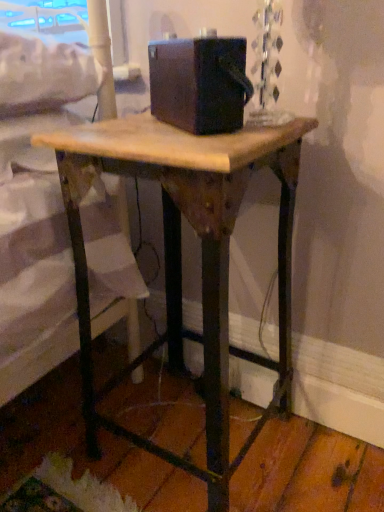
Where is `free space underneath wooden table at center (from a real-world perspective)`? free space underneath wooden table at center (from a real-world perspective) is located at coordinates (197, 430).